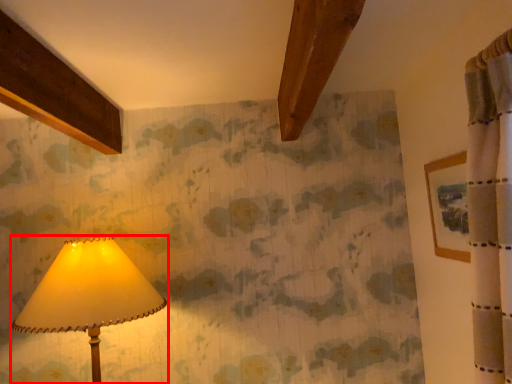
Question: From the image's perspective, considering the relative positions of lamp (annotated by the red box) and picture frame in the image provided, where is lamp (annotated by the red box) located with respect to the staircase?

Choices:
 (A) below
 (B) above

Answer: (A)